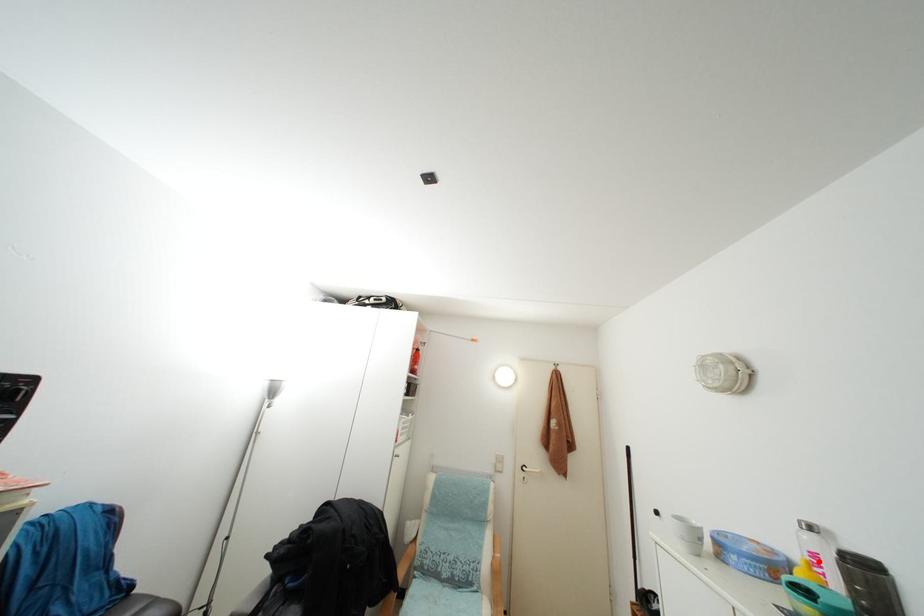
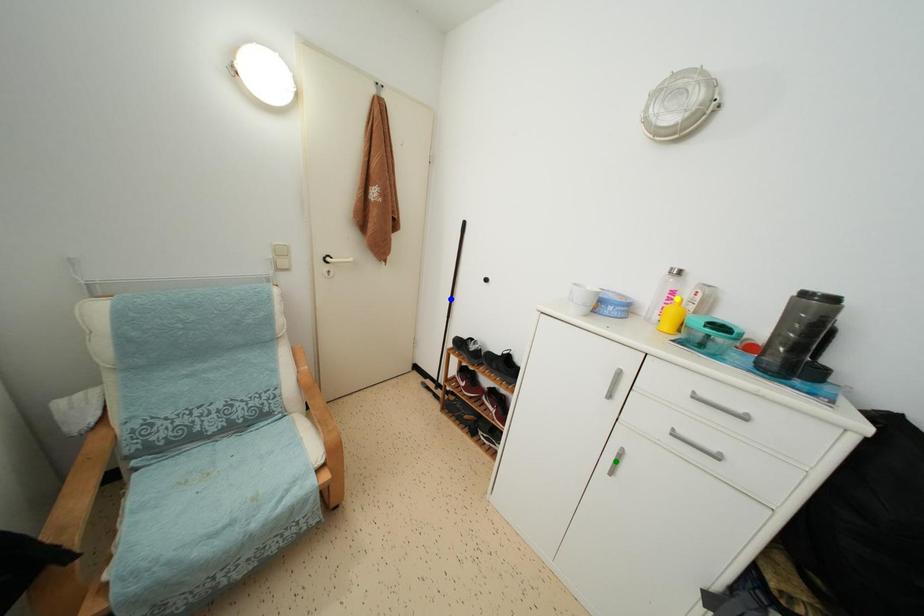
Question: I am providing you with two images of the same scene from different viewpoints. A red point is marked on the first image. You are given multiple points on the second image. In image 2, which mark is for the same physical point as the one in image 1?

Choices:
 (A) green point
 (B) yellow point
 (C) blue point

Answer: (B)